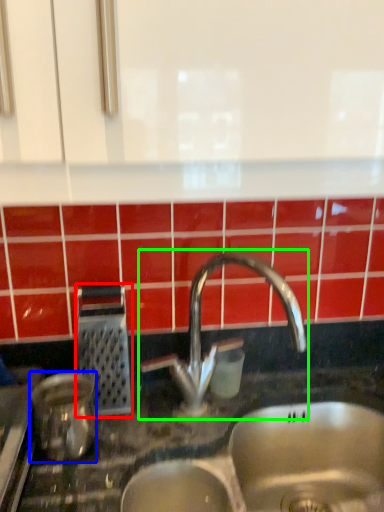
Question: Considering the real-world distances, which object is closest to appliance (highlighted by a red box)? appliance (highlighted by a blue box) or tap (highlighted by a green box).

Choices:
 (A) appliance
 (B) tap

Answer: (A)